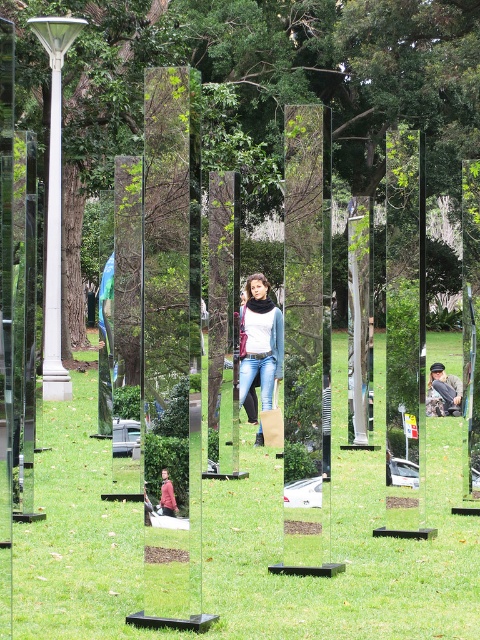
You are standing in the park and see the green leafy tree at center. If you walk straight ahead, will you eventually reach the tree?

Yes, since the green leafy tree at center is located at point (255, 80), walking straight ahead in the park would lead you towards the tree.

You are standing in front of the row of tall mirrors in the grassy area. There is a point at coordinates point (264, 10). Can you determine if this point is closer to you or farther away than the mirrors?

The distance of point (264, 10) from camera is 45.72 meters, so the point is farther away than the mirrors since the mirrors are part of the scene in front of you and the point is at 45.72 meters distance.

You are standing in the park and see the point at coordinates (343, 548). What is the most likely object located at that point?

The point at coordinates (343, 548) is green grass at center.